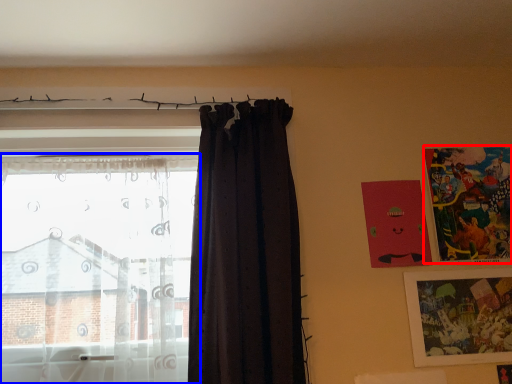
Question: Which object appears closest to the camera in this image, picture frame (highlighted by a red box) or curtain (highlighted by a blue box)?

Choices:
 (A) picture frame
 (B) curtain

Answer: (B)